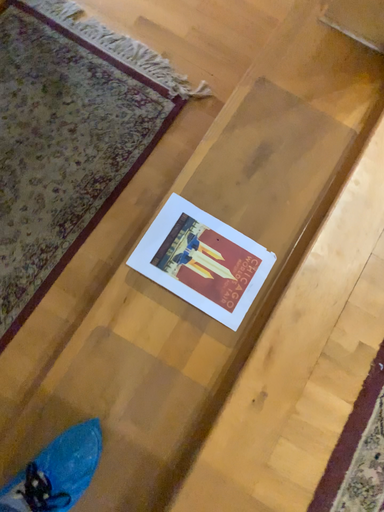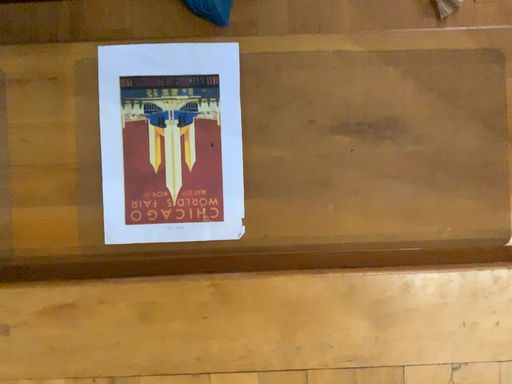
Question: Which way did the camera rotate in the video?

Choices:
 (A) rotated left
 (B) rotated right

Answer: (A)